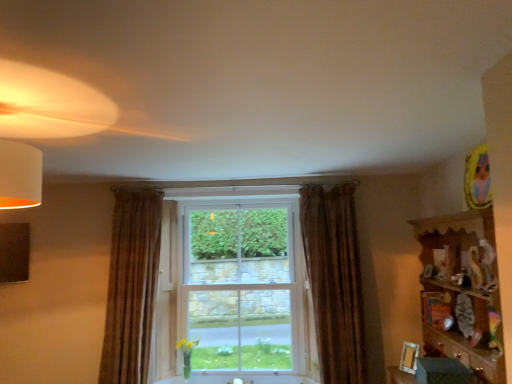
Question: Visually, is brown textured curtain at left, which is the second curtain from right to left, positioned to the left or to the right of wooden picture frame at lower right?

Choices:
 (A) right
 (B) left

Answer: (B)

Question: From a real-world perspective, is brown textured curtain at left, arranged as the 1th curtain when viewed from the left, physically located above or below wooden picture frame at lower right?

Choices:
 (A) below
 (B) above

Answer: (B)

Question: Which object is the closest to the wooden picture frame at lower right?

Choices:
 (A) brown textured curtain at left, arranged as the 1th curtain when viewed from the left
 (B) wooden shelf at right
 (C) brown velvet curtain at center, arranged as the 1th curtain when viewed from the right
 (D) clear glass window at center

Answer: (B)

Question: Which is nearer to the brown velvet curtain at center, arranged as the 1th curtain when viewed from the right?

Choices:
 (A) brown textured curtain at left, which is the second curtain from right to left
 (B) wooden shelf at right
 (C) wooden picture frame at lower right
 (D) clear glass window at center

Answer: (C)